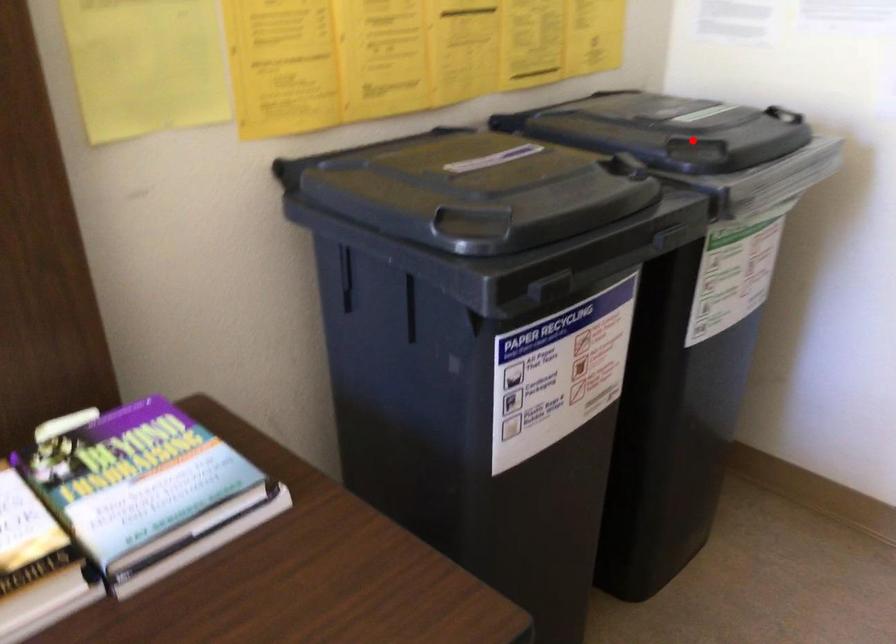
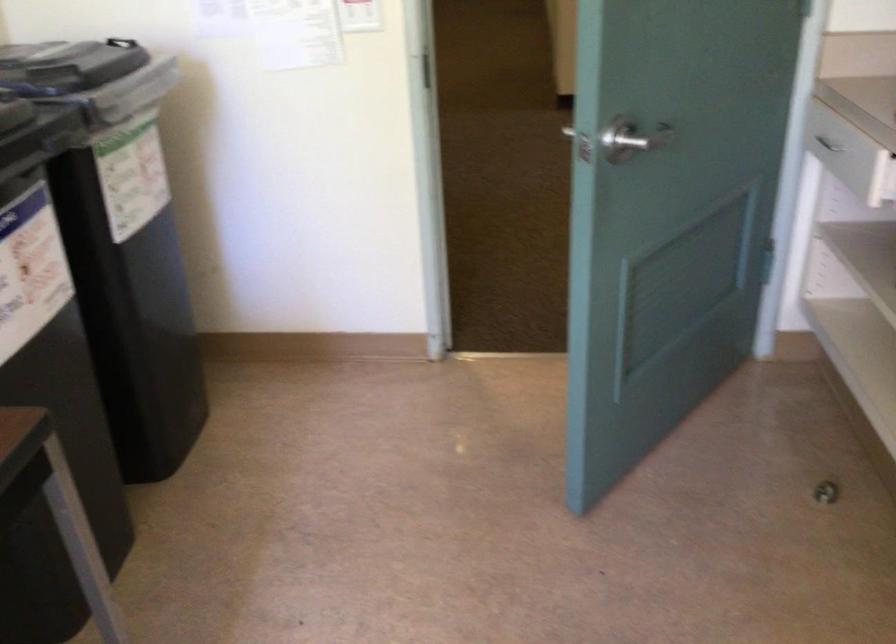
Question: A red point is marked in image1. In image2, is the corresponding 3D point closer to the camera or farther? Reply with the corresponding letter.

Choices:
 (A) The corresponding 3D point is closer.
 (B) The corresponding 3D point is farther.

Answer: (B)